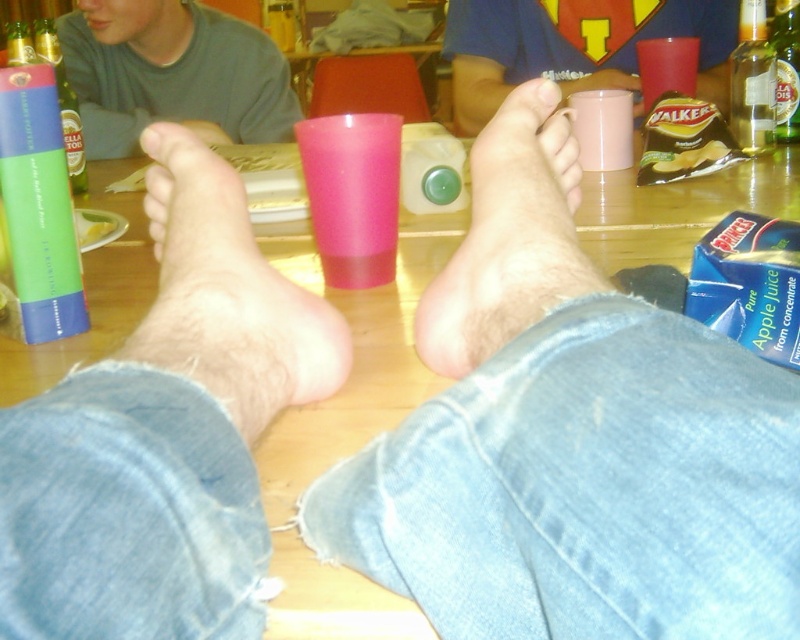
Does dry skin foot at center have a lesser width compared to pink matte toe at center?

Incorrect, dry skin foot at center's width is not less than pink matte toe at center's.

Does dry skin foot at center have a larger size compared to pink matte toe at center?

Indeed, dry skin foot at center has a larger size compared to pink matte toe at center.

Looking at this image, who is more distant from viewer, (552,180) or (144,152)?

The point (144,152) is more distant.

Locate an element on the screen. dry skin foot at center is located at coordinates (508, 240).

Which is behind, point (158, 349) or point (560, 90)?

Point (560, 90)

Can you confirm if hairy skin foot at center is taller than smooth skin toe at center?

Yes.

Where is `hairy skin foot at center`? The width and height of the screenshot is (800, 640). hairy skin foot at center is located at coordinates (228, 296).

The image size is (800, 640). Identify the location of hairy skin foot at center. (228, 296).

Can you confirm if clear glass bottle at upper right is wider than smooth skin toe at center?

Yes, clear glass bottle at upper right is wider than smooth skin toe at center.

How distant is clear glass bottle at upper right from smooth skin toe at center?

clear glass bottle at upper right is 22.78 inches away from smooth skin toe at center.

Does point (786, 51) come closer to viewer compared to point (540, 96)?

No, (786, 51) is behind (540, 96).

Where is `clear glass bottle at upper right`? clear glass bottle at upper right is located at coordinates (786, 68).